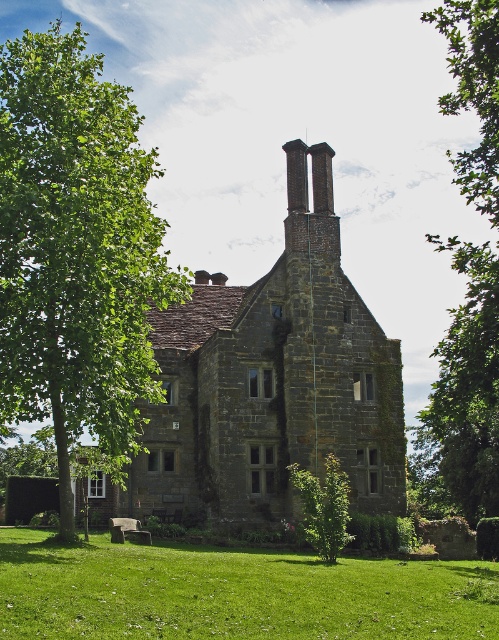
Question: Can you confirm if green leafy tree at left is smaller than green grass at lower center?

Choices:
 (A) yes
 (B) no

Answer: (B)

Question: Can you confirm if green leafy tree at left is positioned above green grass at lower center?

Choices:
 (A) no
 (B) yes

Answer: (B)

Question: Which point is closer to the camera?

Choices:
 (A) (478, 381)
 (B) (108, 120)
 (C) (279, 596)

Answer: (C)

Question: Can you confirm if green leafy tree at left is wider than green leafy tree at upper right?

Choices:
 (A) yes
 (B) no

Answer: (A)

Question: Which object appears farthest from the camera in this image?

Choices:
 (A) green leafy tree at left
 (B) green leafy tree at upper right

Answer: (B)

Question: Which point is closer to the camera?

Choices:
 (A) green leafy tree at upper right
 (B) green leafy tree at left

Answer: (B)